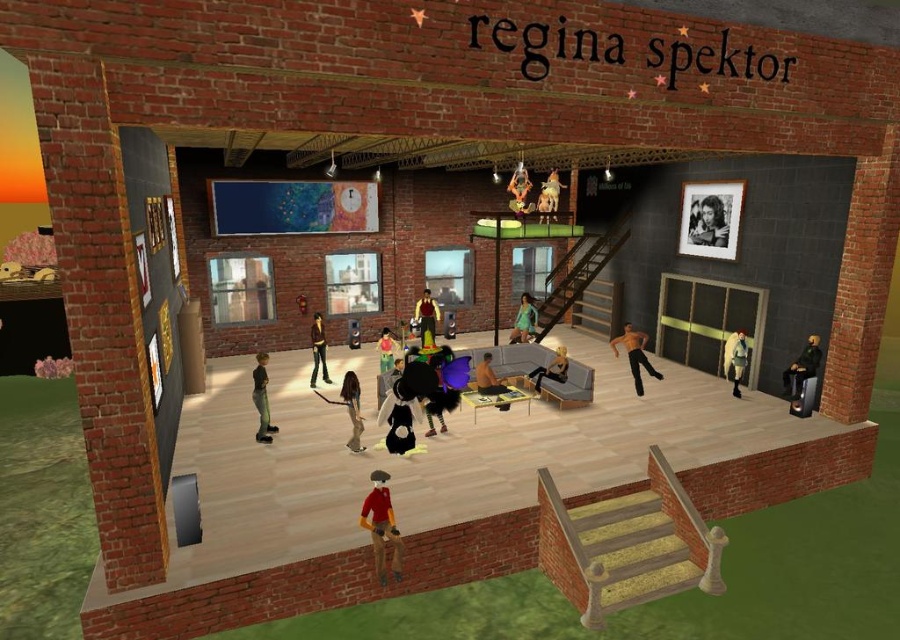
You are a stagehand setting up for a performance and need to adjust the lighting. You notice the orange fabric doll at center and the smooth blue shirt at center. Which object is closer to you, and therefore requires adjusting its lighting first?

The orange fabric doll at center is closer to you than the smooth blue shirt at center, so you should adjust its lighting first.

You are a stagehand preparing to place a new prop on the stage. You have an orange fabric doll at center and a smooth blue shirt at center. Which object is taller?

The orange fabric doll at center is much taller than the smooth blue shirt at center.

You are a stagehand preparing to arrange props on the stage. You have a black leather jacket at lower right and dark gray matte pants at center. Which prop should you adjust if you want to ensure the taller item is placed closer to the audience? Please explain your reasoning.

The dark gray matte pants at center are taller than the black leather jacket at lower right. To place the taller item closer to the audience, you should adjust the black leather jacket at lower right so that the dark gray matte pants at center are positioned nearer to where the audience is sitting.